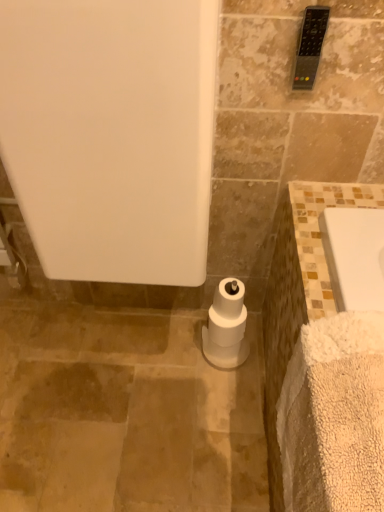
Question: Based on their sizes in the image, would you say white fluffy bath towel at lower right is bigger or smaller than black plastic remote control at upper right?

Choices:
 (A) big
 (B) small

Answer: (A)

Question: Is white fluffy bath towel at lower right taller or shorter than black plastic remote control at upper right?

Choices:
 (A) short
 (B) tall

Answer: (B)

Question: Estimate the real-world distances between objects in this image. Which object is farther from the white fluffy bath towel at lower right?

Choices:
 (A) white matte bathtub at center
 (B) black plastic remote control at upper right
 (C) white matte toilet paper at center

Answer: (B)

Question: Considering the real-world distances, which object is closest to the white matte bathtub at center?

Choices:
 (A) white fluffy bath towel at lower right
 (B) black plastic remote control at upper right
 (C) white matte toilet paper at center

Answer: (A)